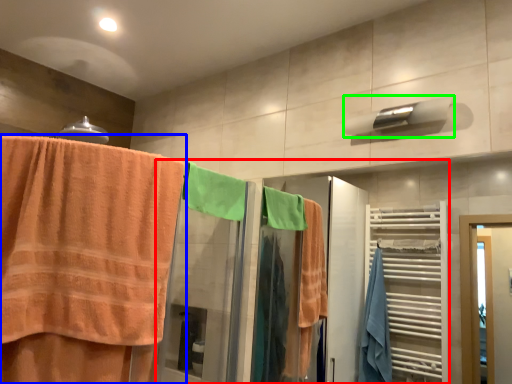
Question: Based on their relative distances, which object is farther from closet (highlighted by a red box)? Choose from towel (highlighted by a blue box) and towel bar (highlighted by a green box).

Choices:
 (A) towel
 (B) towel bar

Answer: (B)